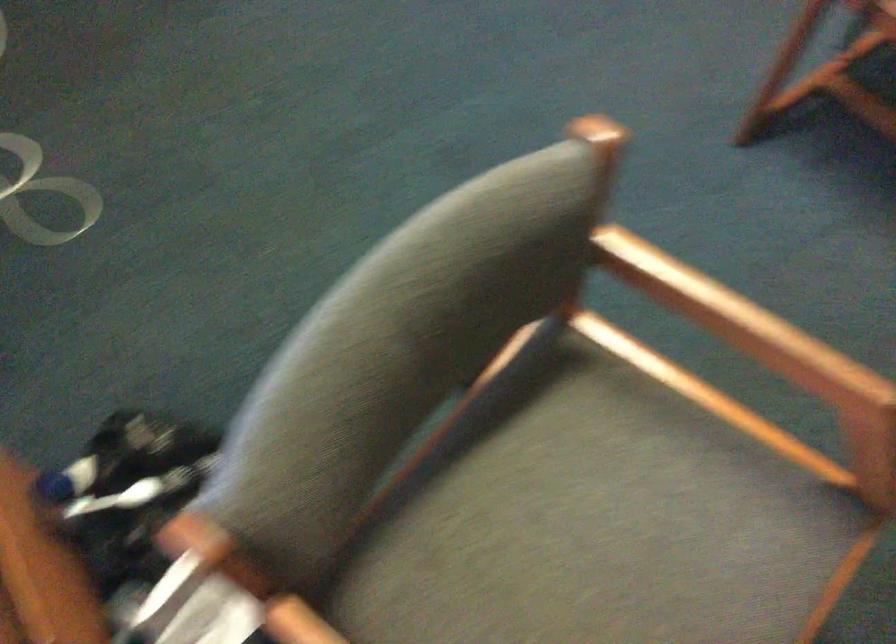
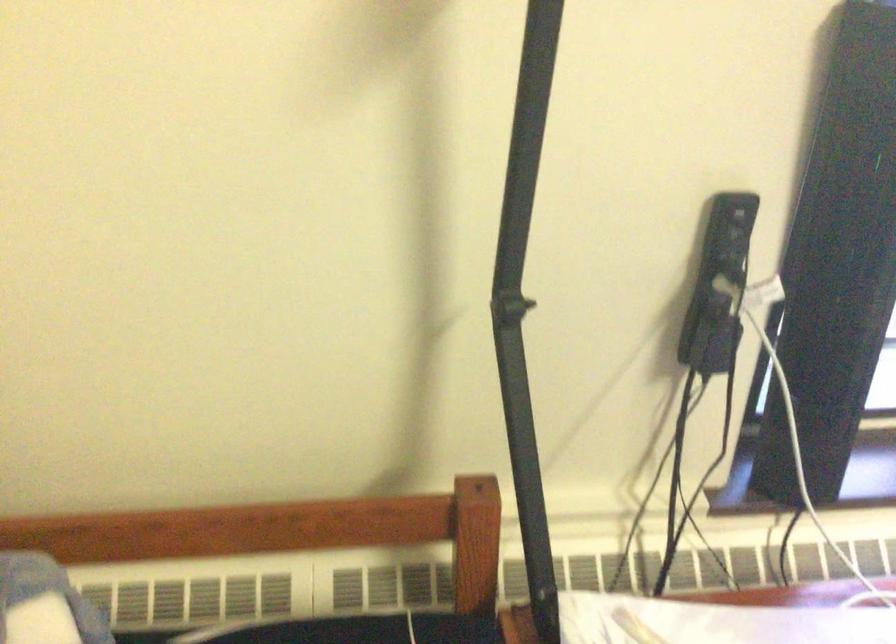
The images are taken continuously from a first-person perspective. In which direction is your viewpoint rotating?

The camera's rotation is toward left-down.